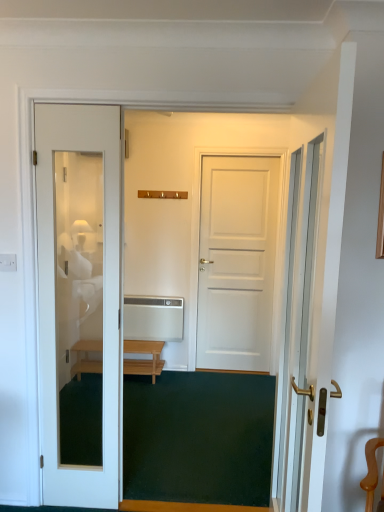
Find the location of `light wood/matte finish bench at center`. light wood/matte finish bench at center is located at coordinates (144, 360).

What do you see at coordinates (144, 360) in the screenshot? The image size is (384, 512). I see `light wood/matte finish bench at center` at bounding box center [144, 360].

Measure the distance between light wood/matte finish bench at center and camera.

light wood/matte finish bench at center is 3.68 meters from camera.

Locate an element on the screen. The width and height of the screenshot is (384, 512). light wood/matte finish bench at center is located at coordinates (144, 360).